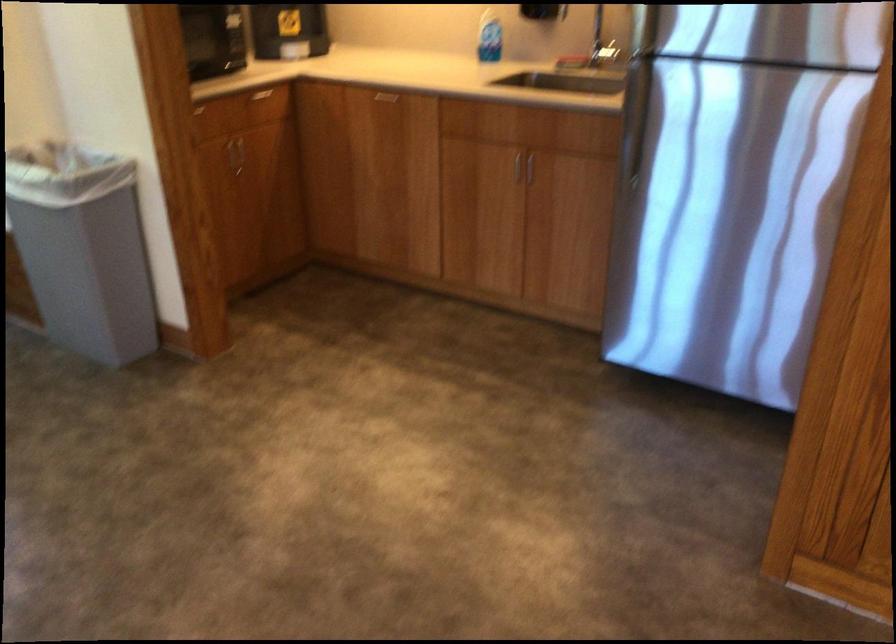
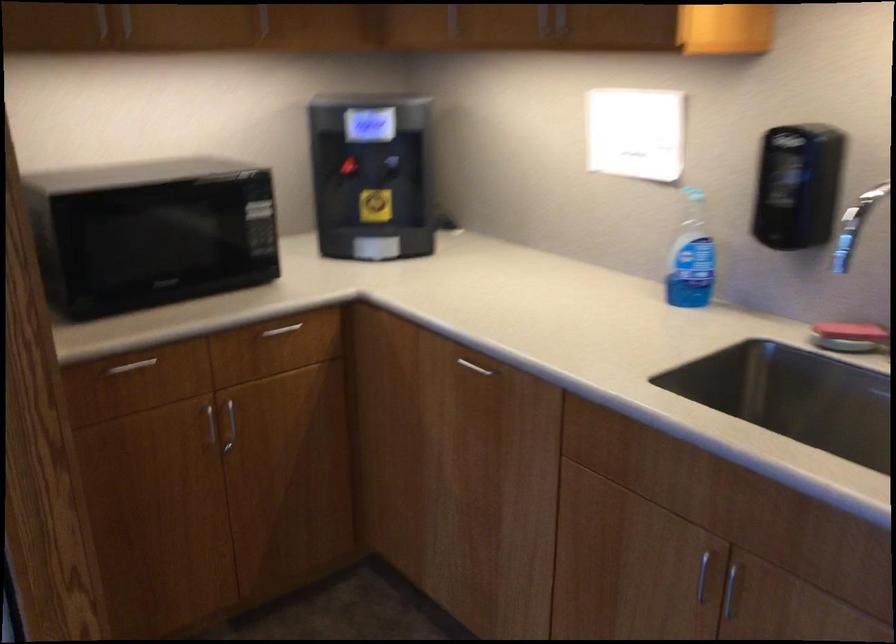
Locate, in the second image, the point that corresponds to (x=383, y=99) in the first image.

(475, 366)